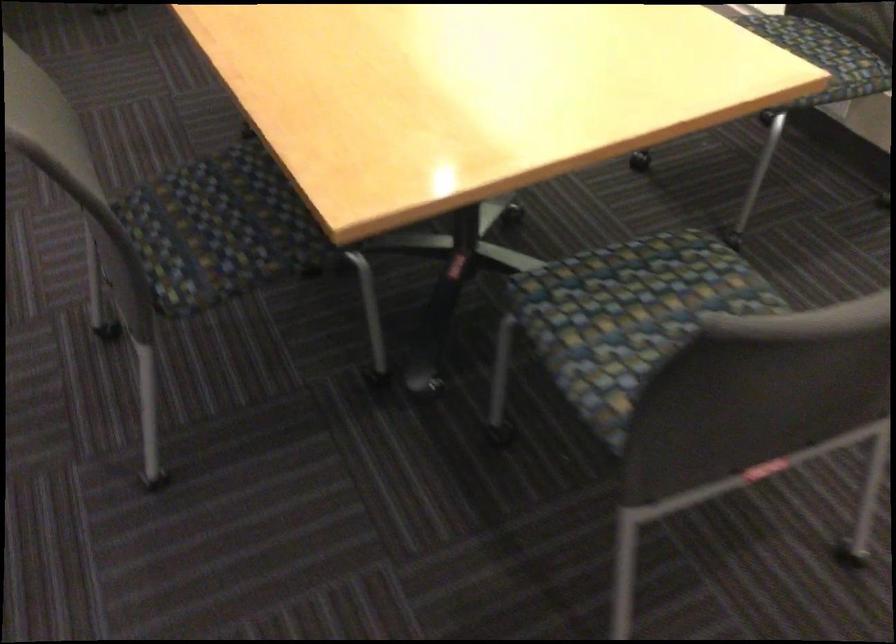
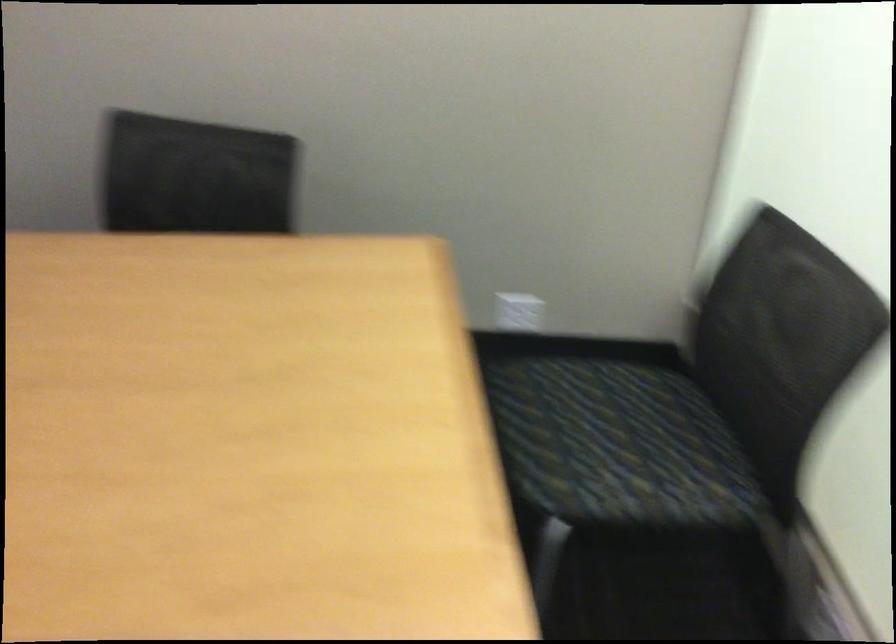
Question: In a continuous first-person perspective shot, in which direction is the camera moving?

Choices:
 (A) Left
 (B) Right
 (C) Forward
 (D) Backward

Answer: (C)